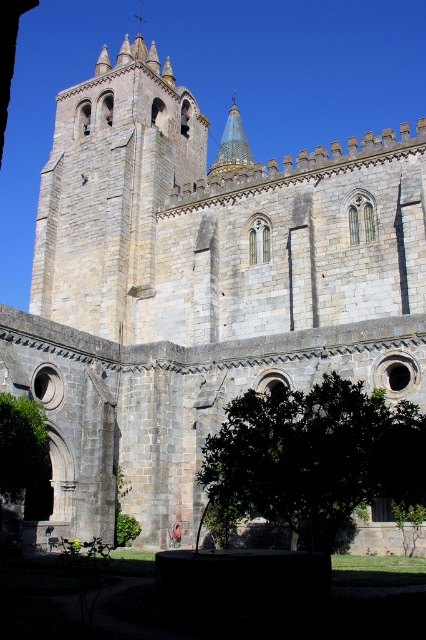
You are standing in front of the grand medieval stone building. You notice two points marked on the building. The first point is at coordinate point (370, 470) and the second is at point (5, 468). Which point is closer to your current position?

Point (370, 470) is closer to the camera than point (5, 468), so the first point is closer to your current position.

You are standing at the entrance of the grand medieval stone building and want to take a photo of the green leafy tree at lower center. To ensure the tree is in the frame, where should you position your camera relative to the building?

The green leafy tree at lower center is located at coordinates point (313, 456), so you should position your camera to the right side of the building to capture it in the frame.